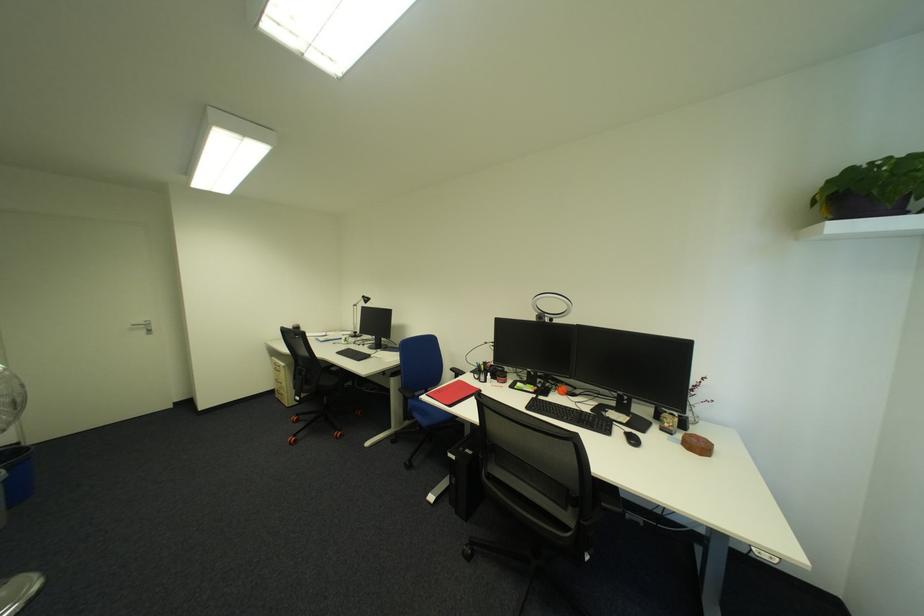
Where would you pull the silver door handle? Please return your answer as a coordinate pair (x, y).

(142, 326)